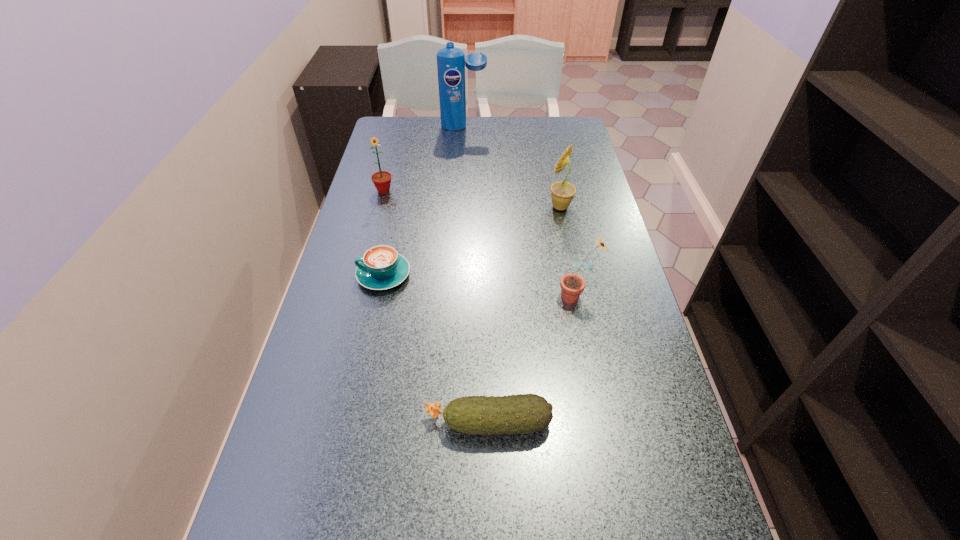
Where is `the tallest object`? the tallest object is located at coordinates (451, 61).

I want to click on shampoo, so click(x=451, y=61).

Where is `the second farthest sunflower`? The height and width of the screenshot is (540, 960). the second farthest sunflower is located at coordinates (562, 193).

You are a GUI agent. You are given a task and a screenshot of the screen. Output one action in this format:
    pyautogui.click(x=<x>, y=<y>)
    Task: Click on the farthest sunflower
    The height and width of the screenshot is (540, 960).
    Given the screenshot: What is the action you would take?
    pyautogui.click(x=382, y=179)

You are a GUI agent. You are given a task and a screenshot of the screen. Output one action in this format:
    pyautogui.click(x=<x>, y=<y>)
    Task: Click on the fifth nearest object
    This screenshot has width=960, height=540.
    Given the screenshot: What is the action you would take?
    pyautogui.click(x=382, y=179)

Identify the location of the nearest sunflower. (572, 285).

Find the location of a particular element. the nearest object is located at coordinates (525, 413).

You are a GUI agent. You are given a task and a screenshot of the screen. Output one action in this format:
    pyautogui.click(x=<x>, y=<y>)
    Task: Click on the cappuccino
    
    Given the screenshot: What is the action you would take?
    pyautogui.click(x=381, y=267)

Locate an element on the screen. vacant space situated on the right of the farthest object is located at coordinates (575, 127).

Image resolution: width=960 pixels, height=540 pixels. I want to click on vacant space situated 0.120m on the face of the second nearest sunflower, so click(x=508, y=207).